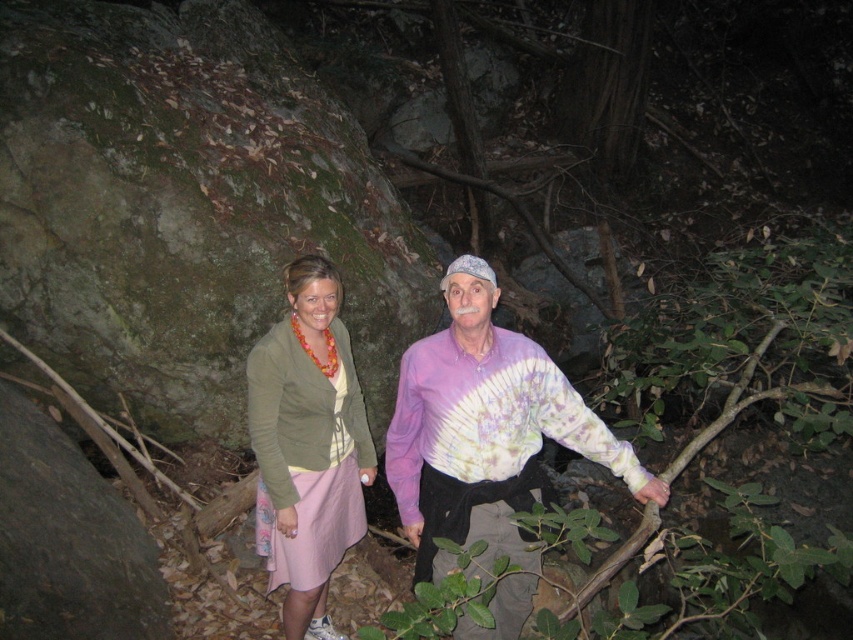
Between tie-dye fabric shirt at center and matte olive green cardigan at center, which one appears on the left side from the viewer's perspective?

From the viewer's perspective, matte olive green cardigan at center appears more on the left side.

Measure the distance from tie-dye fabric shirt at center to matte olive green cardigan at center.

tie-dye fabric shirt at center is 23.83 inches away from matte olive green cardigan at center.

Does point (440, 563) lie behind point (334, 388)?

No, it is in front of (334, 388).

Locate an element on the screen. The image size is (853, 640). tie-dye fabric shirt at center is located at coordinates (486, 444).